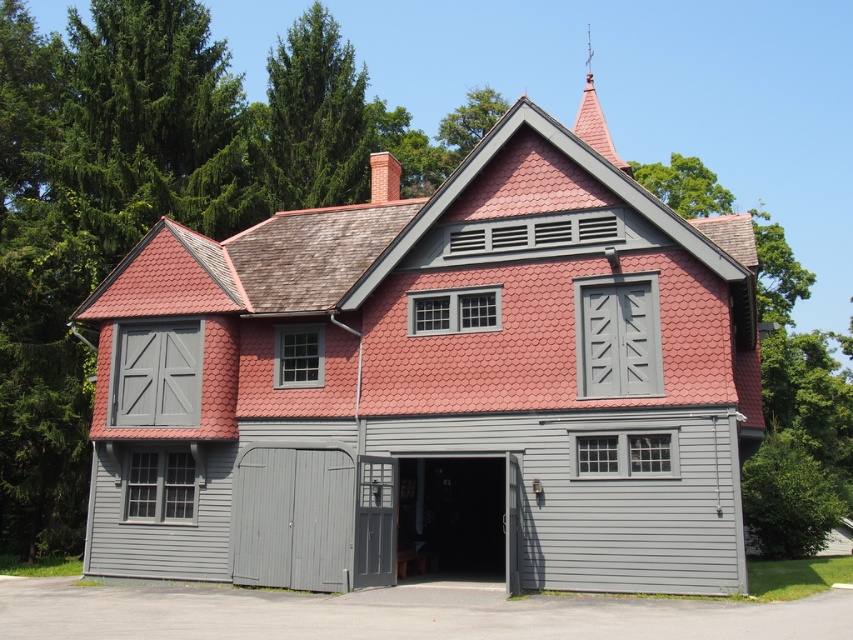
Question: Can you confirm if matte gray shed at center is positioned to the right of gray wood/grey siding garage door at lower left?

Choices:
 (A) no
 (B) yes

Answer: (B)

Question: Is matte gray shed at center behind gray wood/grey siding garage door at lower left?

Choices:
 (A) yes
 (B) no

Answer: (B)

Question: Which object is closer to the camera taking this photo?

Choices:
 (A) matte gray shed at center
 (B) gray wood/grey siding garage door at lower left

Answer: (A)

Question: In this image, where is matte gray shed at center located relative to gray wood/grey siding garage door at lower left?

Choices:
 (A) above
 (B) below

Answer: (A)

Question: Which point is closer to the camera?

Choices:
 (A) gray wood/grey siding garage door at lower left
 (B) matte gray shed at center

Answer: (B)